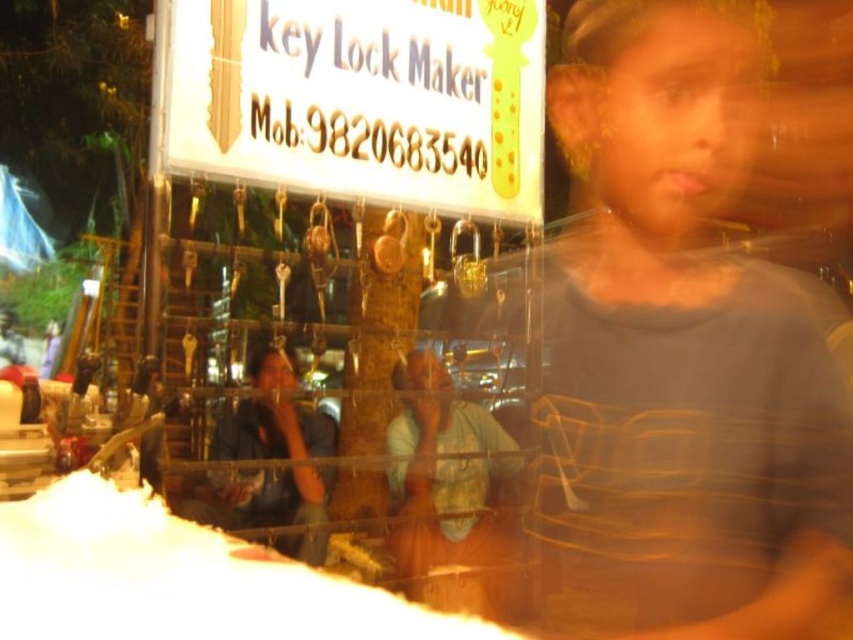
Question: Considering the relative positions of blue fabric shirt at center and black leather jacket at lower left in the image provided, where is blue fabric shirt at center located with respect to black leather jacket at lower left?

Choices:
 (A) above
 (B) below

Answer: (A)

Question: Can you confirm if blue fabric shirt at center is positioned below black leather jacket at lower left?

Choices:
 (A) no
 (B) yes

Answer: (A)

Question: Can you confirm if blue fabric shirt at center is positioned to the left of black leather jacket at lower left?

Choices:
 (A) no
 (B) yes

Answer: (A)

Question: Which point appears farthest from the camera in this image?

Choices:
 (A) (267, 497)
 (B) (469, 513)

Answer: (A)